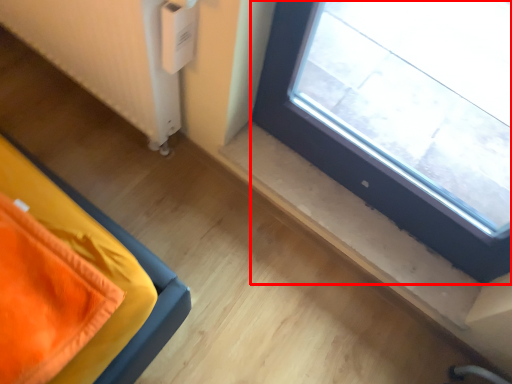
Question: From the image's perspective, what is the correct spatial relationship of window (annotated by the red box) in relation to radiator?

Choices:
 (A) above
 (B) below

Answer: (B)